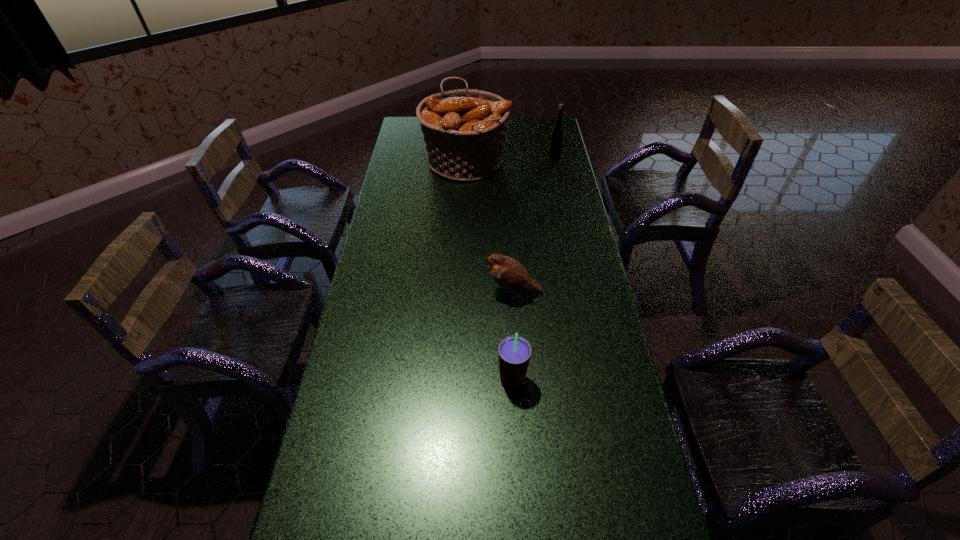
I want to click on vacant area situated 0.260m at the face of the shortest object, so (406, 292).

Where is `vacant region located at the face of the shortest object`? The height and width of the screenshot is (540, 960). vacant region located at the face of the shortest object is located at coordinates (x=400, y=292).

At what (x,y) coordinates should I click in order to perform the action: click on free region located 0.240m at the face of the shortest object. Please return your answer as a coordinate pair (x, y). Looking at the image, I should click on (412, 292).

The image size is (960, 540). Identify the location of object located in the far edge section of the desktop. (464, 130).

Identify the location of object located in the left edge section of the desktop. (464, 130).

Image resolution: width=960 pixels, height=540 pixels. Identify the location of object that is positioned at the right edge. (557, 134).

The height and width of the screenshot is (540, 960). Identify the location of object that is positioned at the far left corner. (464, 130).

Where is `blank space at the far edge`? The width and height of the screenshot is (960, 540). blank space at the far edge is located at coordinates coord(524,129).

Locate an element on the screen. The image size is (960, 540). vacant area at the left edge is located at coordinates (396, 181).

What are the coordinates of `free space at the right edge` in the screenshot? It's located at (548, 188).